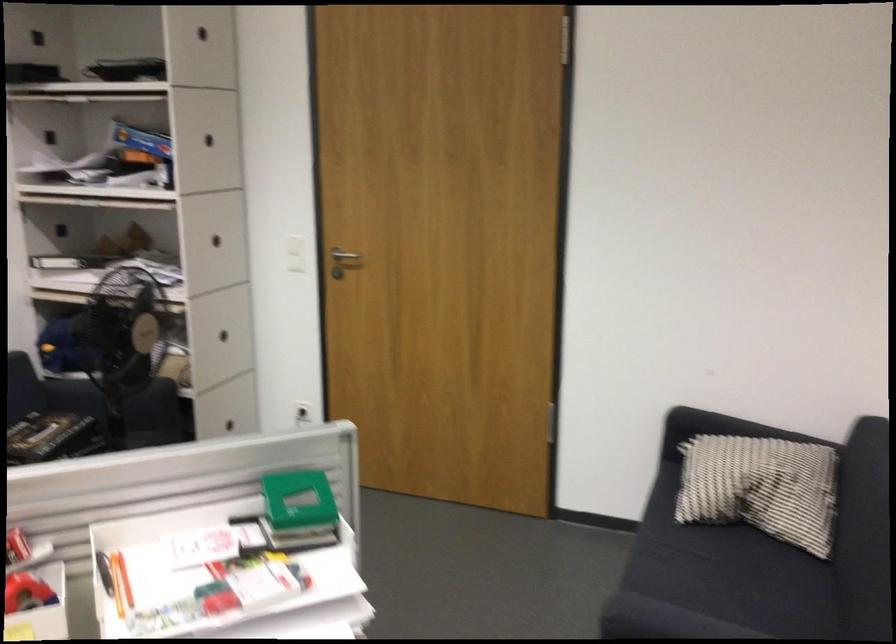
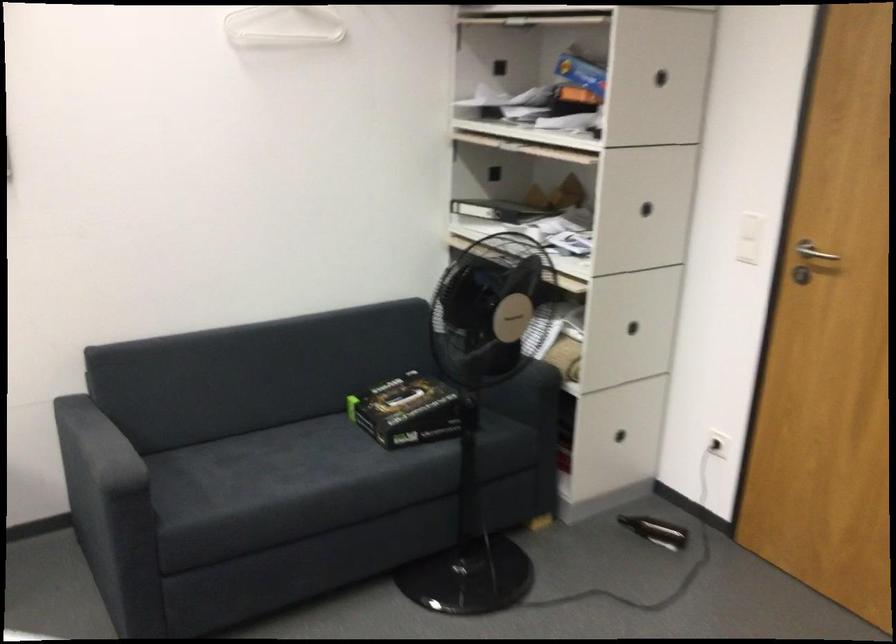
Locate, in the second image, the point that corresponds to point 296,254 in the first image.

(748, 238)